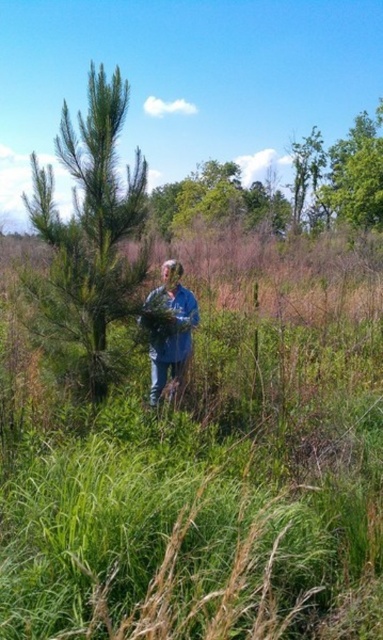
This screenshot has height=640, width=383. In order to click on green leafy tree at upper center in this screenshot , I will do `click(217, 200)`.

Is green leafy tree at upper center to the left of green leafy tree at upper right from the viewer's perspective?

Yes, green leafy tree at upper center is to the left of green leafy tree at upper right.

Who is more distant from viewer, (212,179) or (350,209)?

Positioned behind is point (212,179).

This screenshot has height=640, width=383. I want to click on green leafy tree at upper center, so click(x=217, y=200).

Which is more to the right, green matte tree at center or green leafy tree at upper center?

green leafy tree at upper center

Which of these two, green matte tree at center or green leafy tree at upper center, stands taller?

green leafy tree at upper center is taller.

Looking at this image, measure the distance between point (x=121, y=209) and camera.

Point (x=121, y=209) and camera are 17.54 feet apart from each other.

This screenshot has width=383, height=640. What are the coordinates of `green matte tree at center` in the screenshot? It's located at (91, 227).

Between green matte tree at center and blue denim jacket at center, which one has more height?

green matte tree at center

Who is positioned more to the right, green matte tree at center or blue denim jacket at center?

blue denim jacket at center

Between point (114, 316) and point (155, 362), which one is positioned behind?

The point (155, 362) is more distant.

Locate an element on the screen. green matte tree at center is located at coordinates (91, 227).